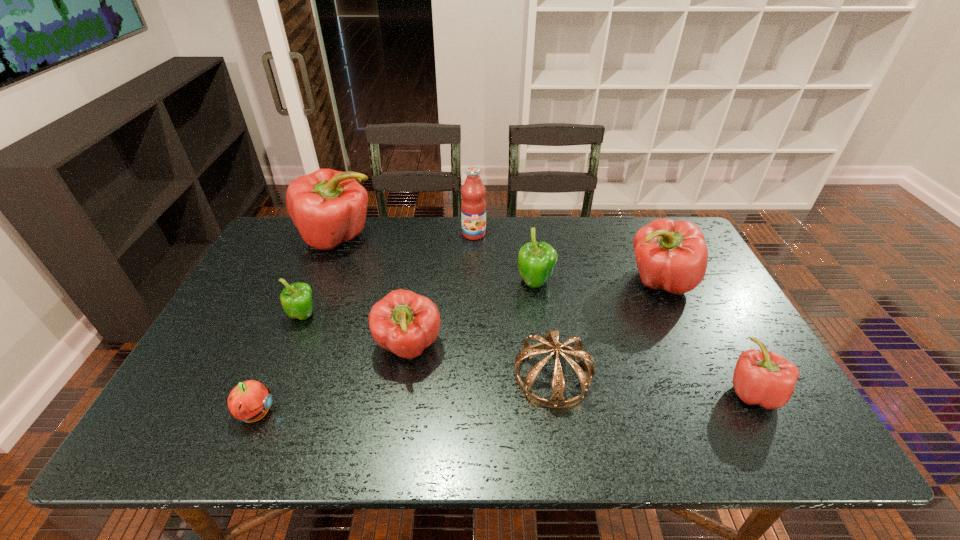
The height and width of the screenshot is (540, 960). Identify the location of object located in the near right corner section of the desktop. (764, 378).

This screenshot has height=540, width=960. I want to click on free spot at the far edge of the desktop, so click(x=428, y=252).

Locate an element on the screen. Image resolution: width=960 pixels, height=540 pixels. free space at the near edge is located at coordinates (570, 418).

In the image, there is a desktop. Where is `vacant space at the left edge`? The width and height of the screenshot is (960, 540). vacant space at the left edge is located at coordinates (280, 307).

In the image, there is a desktop. Where is `vacant space at the near right corner`? This screenshot has width=960, height=540. vacant space at the near right corner is located at coordinates (786, 427).

Image resolution: width=960 pixels, height=540 pixels. I want to click on free space between the second biggest pink bell pepper and the leftmost pink bell pepper, so click(x=499, y=260).

I want to click on free space that is in between the tallest bell pepper and the fifth object from right to left, so click(x=406, y=236).

Locate an element on the screen. The image size is (960, 540). free space between the fruit juice and the tiara is located at coordinates (514, 305).

Find the location of a particular element. The width and height of the screenshot is (960, 540). vacant area that lies between the apple and the leftmost pink bell pepper is located at coordinates (297, 326).

This screenshot has width=960, height=540. What are the coordinates of `unoccupied area between the third pink bell pepper from right to left and the third smallest pink bell pepper` in the screenshot? It's located at (535, 315).